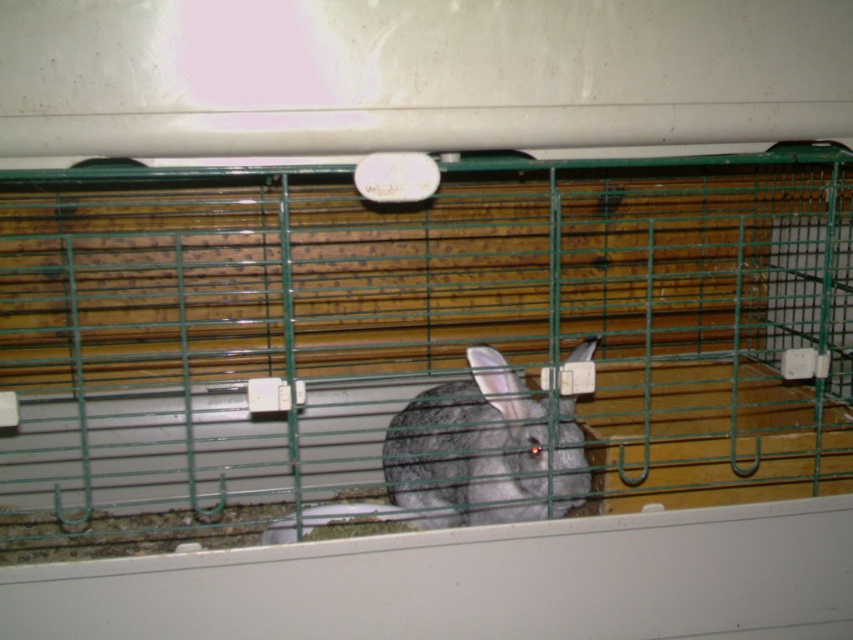
You are a small toy mouse that is 3 inches long. You want to play with the gray furry rabbit at center but are currently outside the green wire cage at center. Can you fit through the space between the cage bars to reach the rabbit?

The green wire cage at center is 12.94 inches away from the gray furry rabbit at center, so the distance between the cage and the rabbit is too large for the toy mouse to traverse. The mouse cannot reach the rabbit through the cage bars.

You are standing in front of the green wire cage at center. If you want to place a small treat exactly at the center of the cage, where should you aim relative to the cage?

The green wire cage at center is located at point (415, 332), so you should aim for the coordinates (415, 332) to place the treat at the center of the cage.